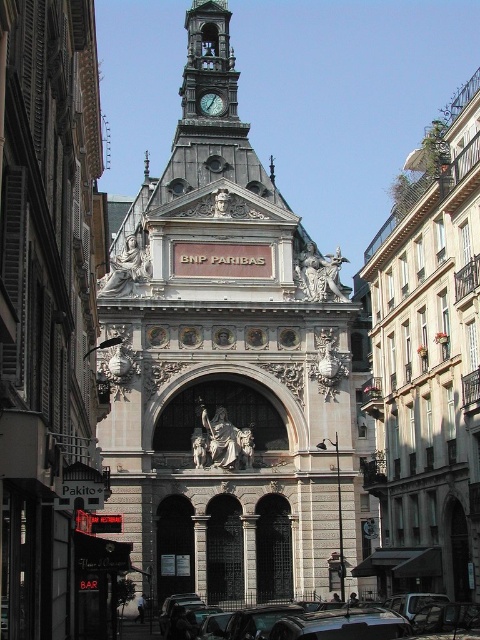
You are standing in front of the BNP Paribas building and notice two points marked on the facade. One is at coordinate point (69, 604) and the other at point (379, 612). Which of these points is closer to you?

Point (69, 604) is closer to you as it is further to the viewer than point (379, 612).

You are a photographer planning to capture the BNP Paribas building with both the metallic silver car at lower center and the green glass clock at upper center in the frame. Which object will occupy more horizontal space in your photo?

The metallic silver car at lower center will occupy more horizontal space in the photo because its width surpasses that of the green glass clock at upper center.